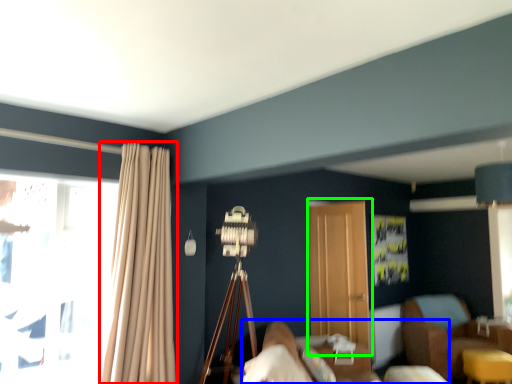
Question: Considering the real-world distances, which object is closest to curtain (highlighted by a red box)? bed (highlighted by a blue box) or screen door (highlighted by a green box).

Choices:
 (A) bed
 (B) screen door

Answer: (A)